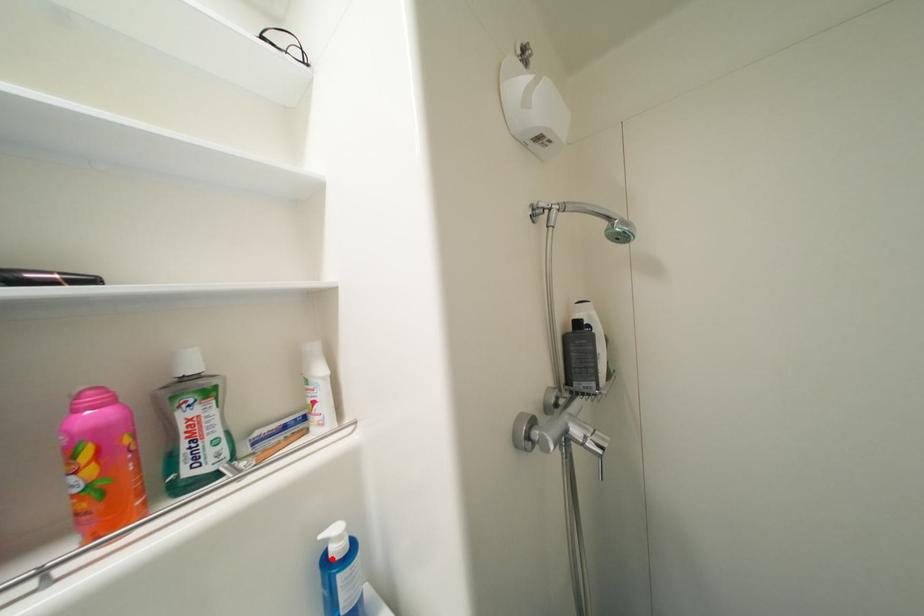
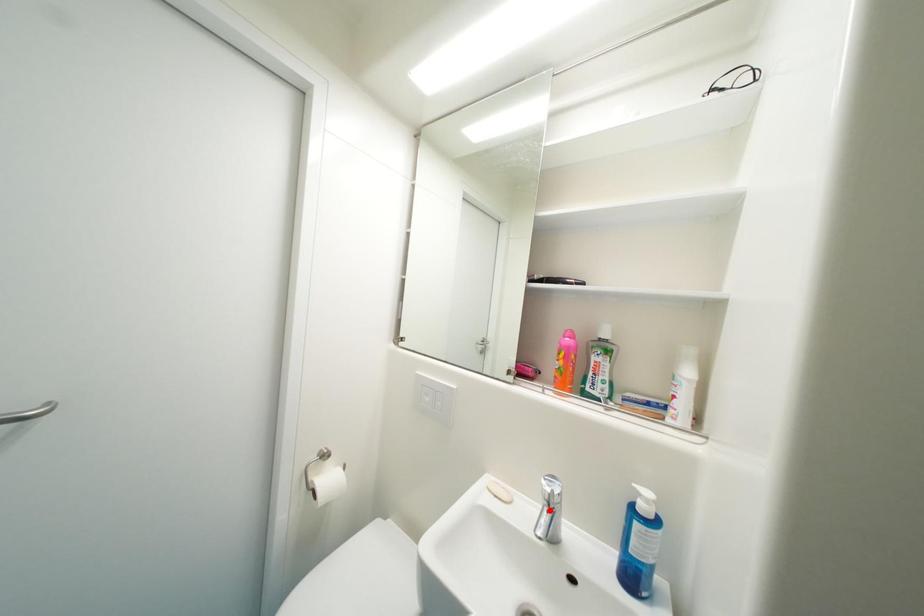
I am providing you with two images of the same scene from different viewpoints. A red point is marked on the first image and another point is marked on the second image. Is the marked point in image1 the same physical position as the marked point in image2?

No